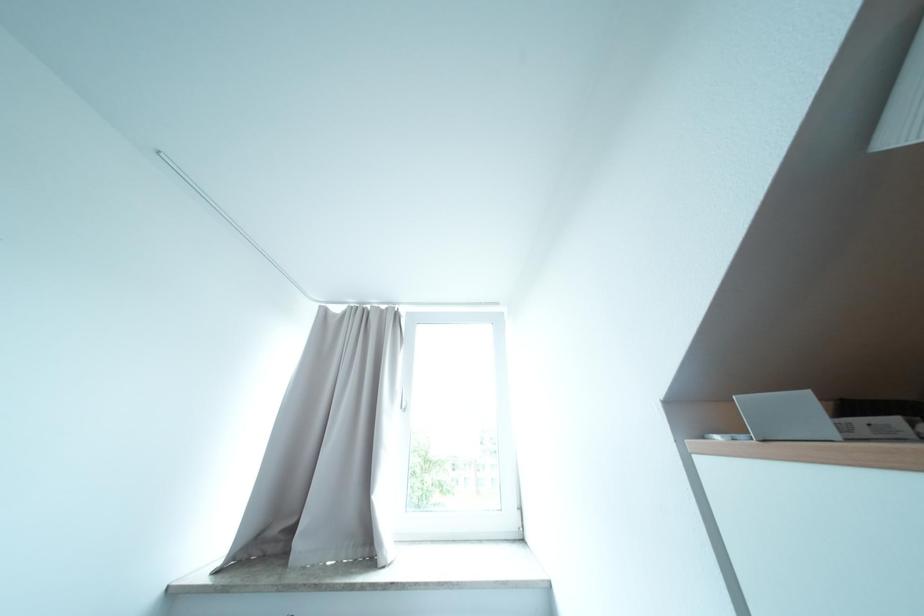
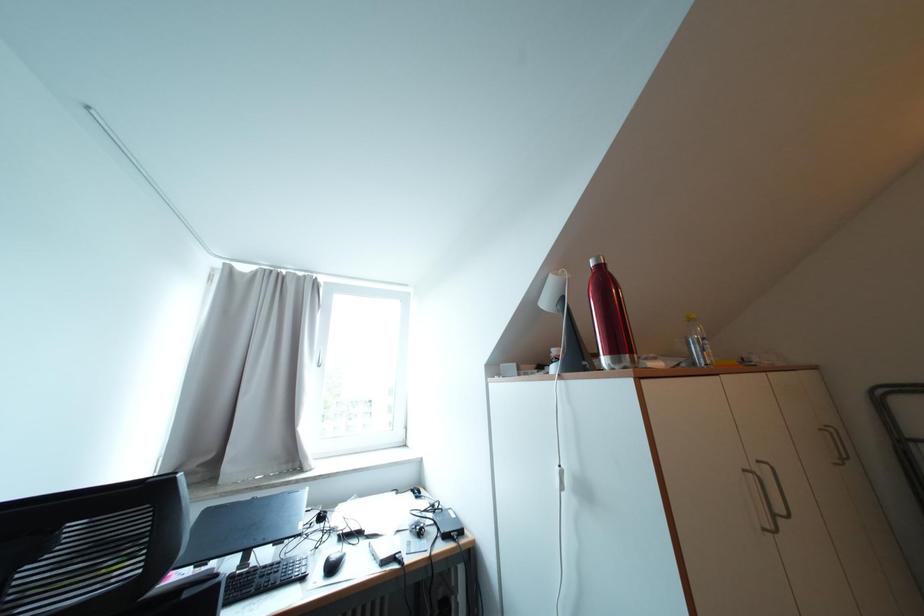
Question: The first image is from the beginning of the video and the second image is from the end. How did the camera likely rotate when shooting the video?

Choices:
 (A) Left
 (B) Right
 (C) Up
 (D) Down

Answer: (B)